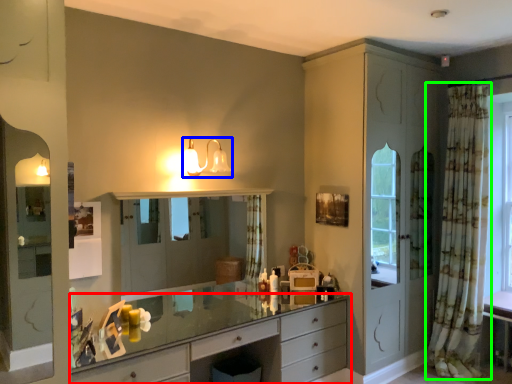
Question: Which object is the closest to the chest of drawers (highlighted by a red box)? Choose among these: light fixture (highlighted by a blue box) or curtain (highlighted by a green box).

Choices:
 (A) light fixture
 (B) curtain

Answer: (A)